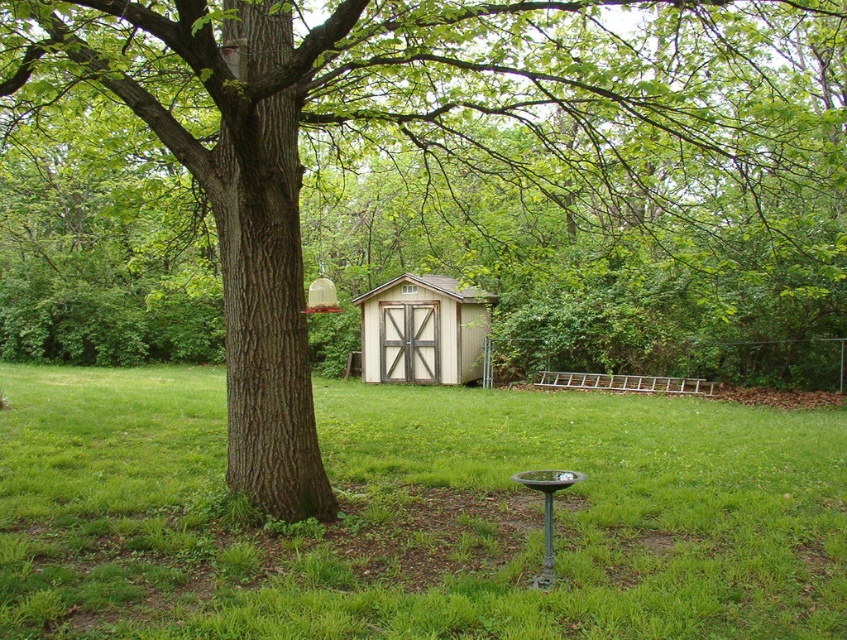
Question: Is the position of green grass at center less distant than that of light brown wooden shed at center?

Choices:
 (A) yes
 (B) no

Answer: (A)

Question: Which of the following is the closest to the observer?

Choices:
 (A) (807, 618)
 (B) (375, 356)

Answer: (A)

Question: In this image, where is green grass at center located relative to light brown wooden shed at center?

Choices:
 (A) left
 (B) right

Answer: (A)

Question: Can you confirm if green grass at center is positioned to the right of light brown wooden shed at center?

Choices:
 (A) yes
 (B) no

Answer: (B)